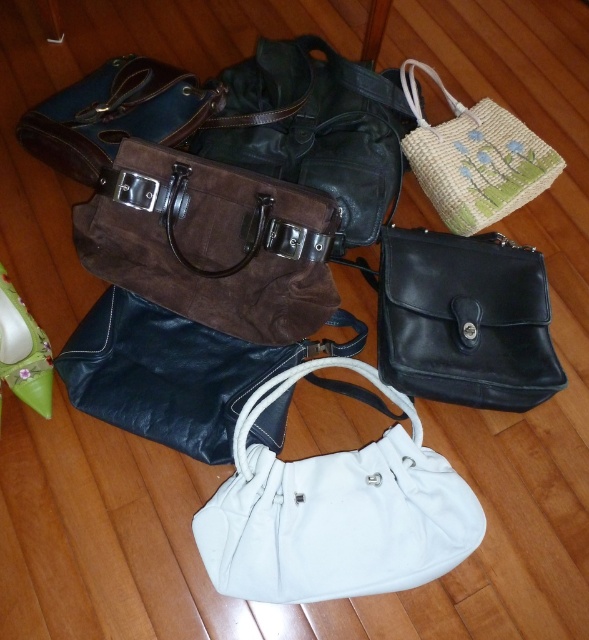
Question: Which point is farther from the camera taking this photo?

Choices:
 (A) (77, 125)
 (B) (399, 342)
 (C) (299, 524)
 (D) (292, 310)

Answer: (A)

Question: Is suede brown briefcase at center to the left of woven straw bag at upper right from the viewer's perspective?

Choices:
 (A) yes
 (B) no

Answer: (A)

Question: Among these objects, which one is farthest from the camera?

Choices:
 (A) green fabric purse at lower left
 (B) suede brown handbag at upper left
 (C) black leather handbag at center
 (D) suede brown briefcase at center

Answer: (B)

Question: Can you confirm if black leather bag at center is smaller than green fabric purse at lower left?

Choices:
 (A) no
 (B) yes

Answer: (A)

Question: Considering the relative positions of black leather bag at center and suede brown handbag at upper left in the image provided, where is black leather bag at center located with respect to suede brown handbag at upper left?

Choices:
 (A) right
 (B) left

Answer: (A)

Question: Which object appears closest to the camera in this image?

Choices:
 (A) black leather bag at center
 (B) white leather handbag at center
 (C) black leather handbag at center

Answer: (B)